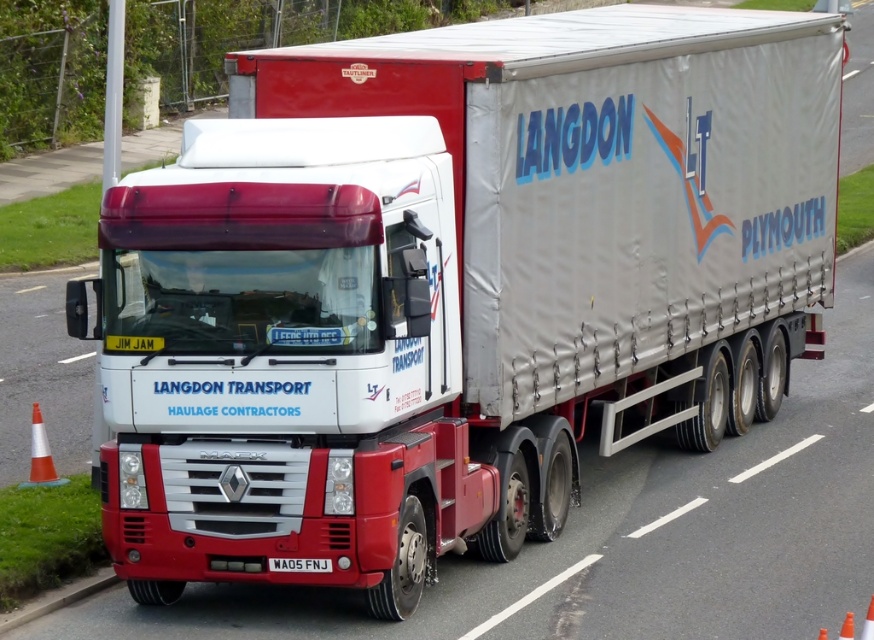
Does black metal license plate at center have a larger size compared to orange plastic traffic cone at lower right?

No.

Can you confirm if black metal license plate at center is positioned above orange plastic traffic cone at lower right?

Indeed, black metal license plate at center is positioned over orange plastic traffic cone at lower right.

Is point (286, 557) positioned behind point (864, 630)?

Yes.

In order to click on black metal license plate at center in this screenshot , I will do `click(299, 564)`.

Is point (38, 406) positioned in front of point (871, 604)?

No, it is not.

Measure the distance between point (37, 422) and camera.

They are 10.17 meters apart.

This screenshot has width=874, height=640. I want to click on orange/white plastic traffic cone at lower left, so click(x=40, y=456).

Is orange/white plastic traffic cone at lower left shorter than black metal license plate at center?

No.

Is orange/white plastic traffic cone at lower left wider than black metal license plate at center?

Correct, the width of orange/white plastic traffic cone at lower left exceeds that of black metal license plate at center.

Where is `orange/white plastic traffic cone at lower left`? orange/white plastic traffic cone at lower left is located at coordinates (40, 456).